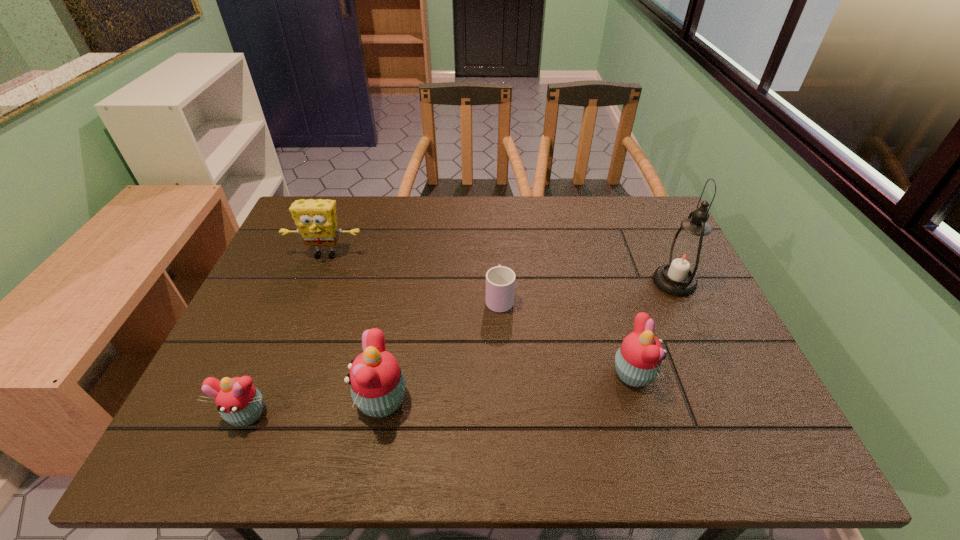
Find the location of a particular element. The width and height of the screenshot is (960, 540). cupcake that stands as the second closest to the tallest object is located at coordinates (378, 386).

This screenshot has height=540, width=960. I want to click on vacant space that satisfies the following two spatial constraints: 1. on the face of the sponge; 2. on the left side of the oil lamp, so click(315, 282).